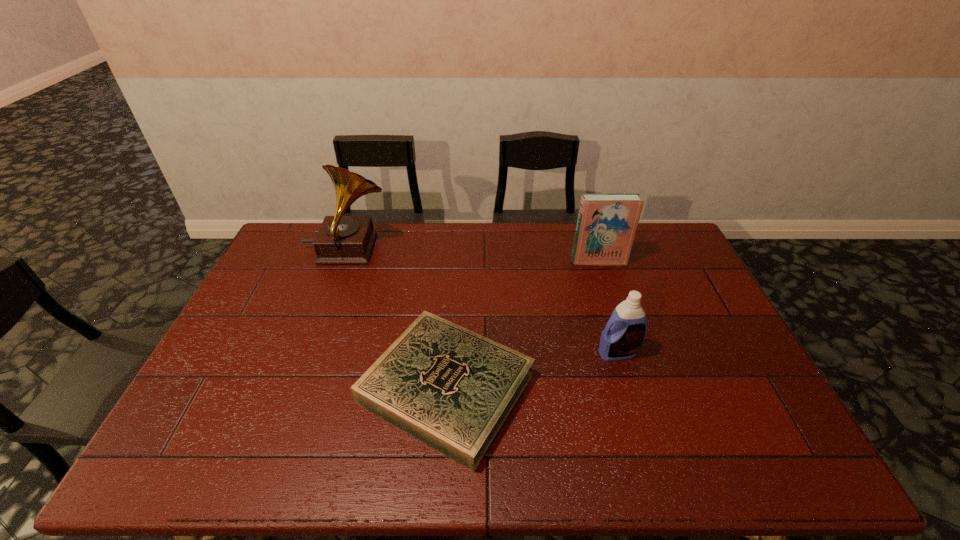
The width and height of the screenshot is (960, 540). In order to click on vacant region located 0.320m on the back of the nearer hardback book in this screenshot , I will do `click(455, 259)`.

Locate an element on the screen. The height and width of the screenshot is (540, 960). phonograph record located at the far edge is located at coordinates (341, 239).

Identify the location of hardback book present at the far edge. The image size is (960, 540). (606, 226).

You are a GUI agent. You are given a task and a screenshot of the screen. Output one action in this format:
    pyautogui.click(x=<x>, y=<y>)
    Task: Click on the object present at the near edge
    The image size is (960, 540).
    Given the screenshot: What is the action you would take?
    pyautogui.click(x=451, y=388)

Where is `object present at the left edge`? object present at the left edge is located at coordinates (341, 239).

Identify the location of object present at the far left corner. (341, 239).

Find the location of `vacant space at the far edge of the desktop`. vacant space at the far edge of the desktop is located at coordinates (530, 239).

At what (x,y) coordinates should I click in order to perform the action: click on vacant space at the near edge of the desktop. Please return your answer as a coordinate pair (x, y). This screenshot has width=960, height=540. Looking at the image, I should click on (523, 460).

Find the location of a particular element. This screenshot has width=960, height=540. vacant space at the left edge is located at coordinates (274, 299).

Find the location of a particular element. This screenshot has width=960, height=540. vacant space at the far left corner is located at coordinates (293, 226).